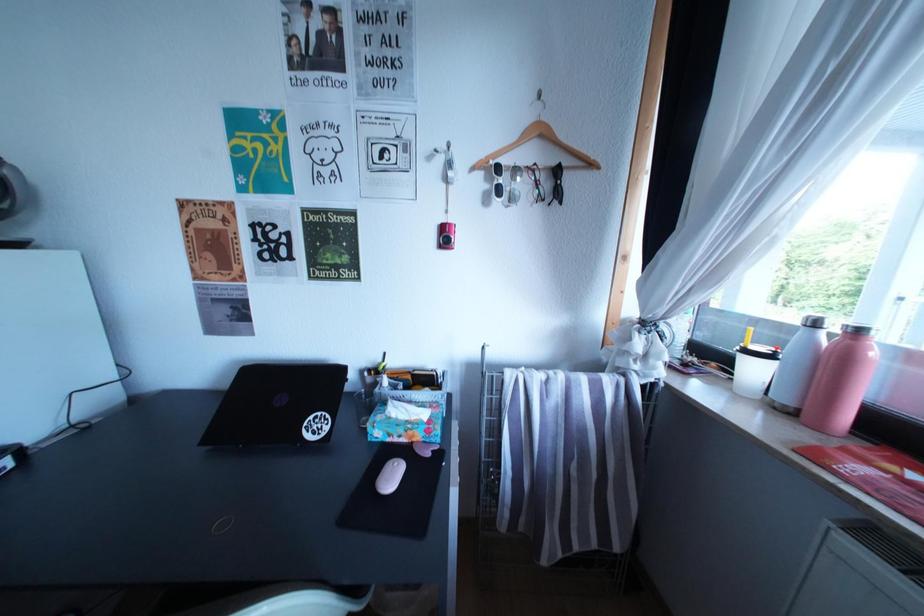
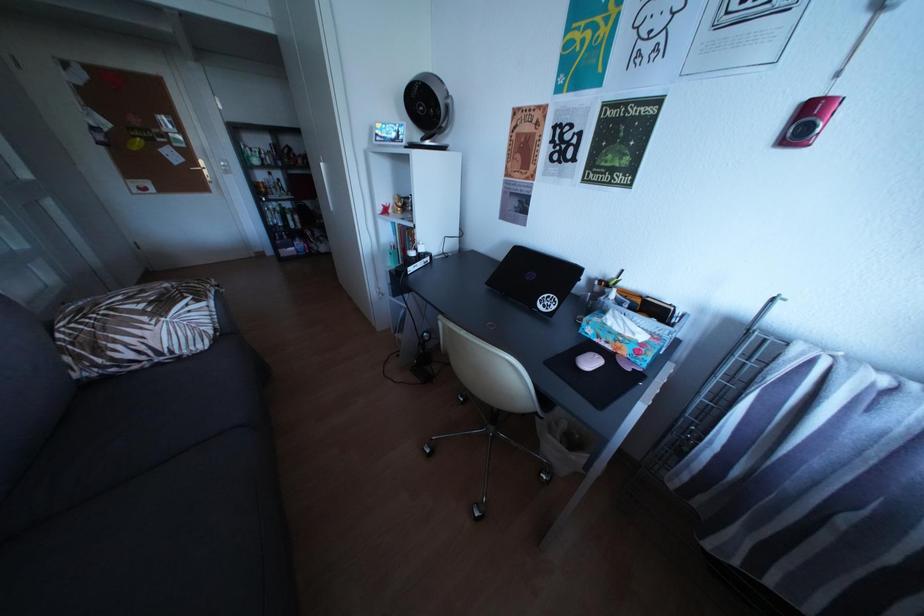
How did the camera likely rotate?

The rotation direction of the camera is left-down.